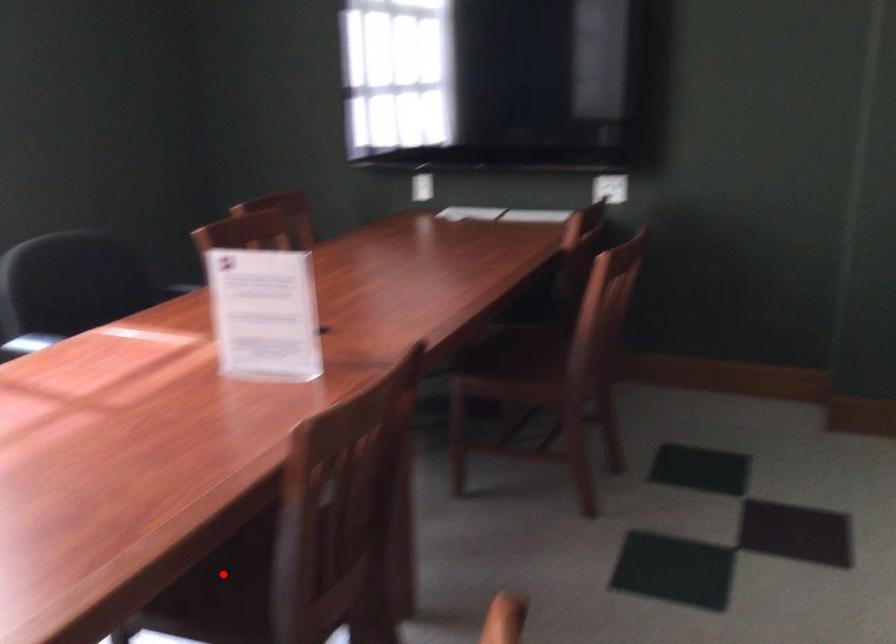
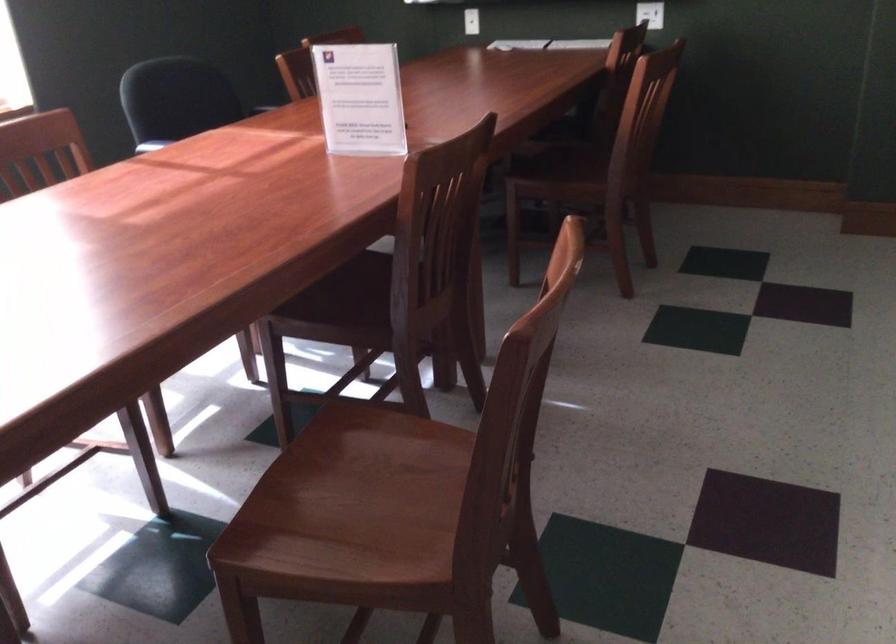
The point at the highlighted location is marked in the first image. Where is the corresponding point in the second image?

(340, 301)